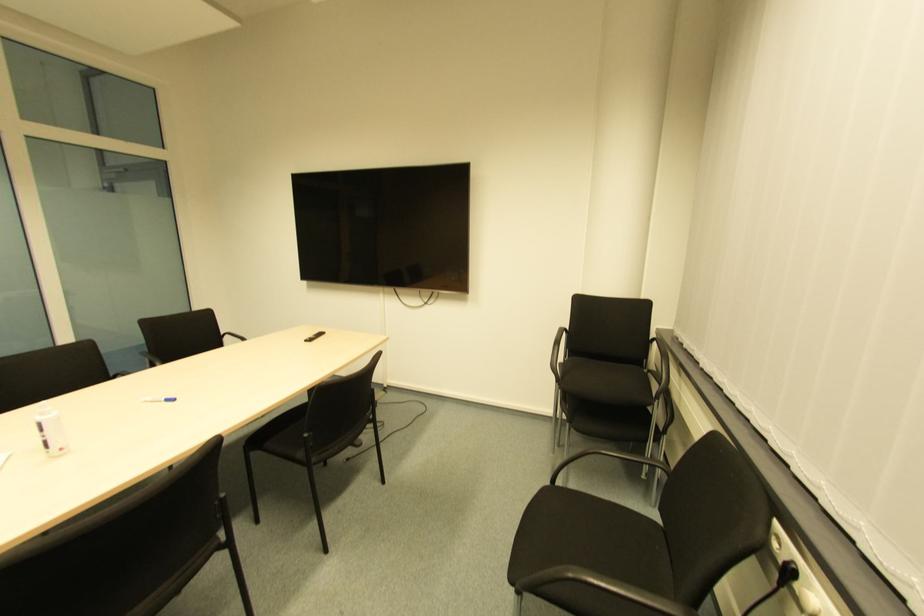
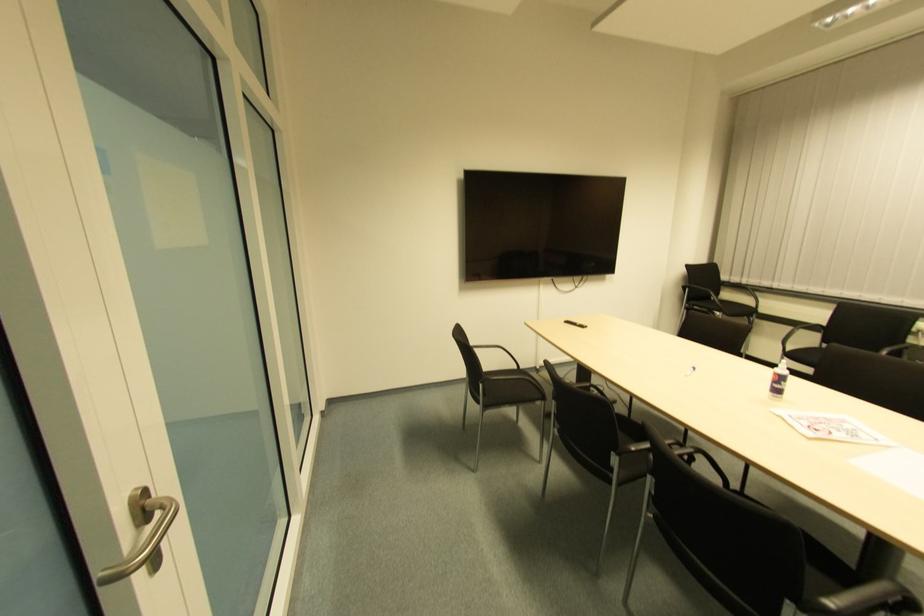
The point at (172, 403) is marked in the first image. Where is the corresponding point in the second image?

(691, 371)